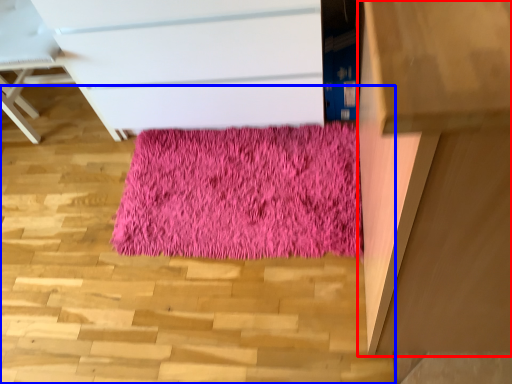
Question: Which object appears closest to the camera in this image, furniture (highlighted by a red box) or stairwell (highlighted by a blue box)?

Choices:
 (A) furniture
 (B) stairwell

Answer: (B)